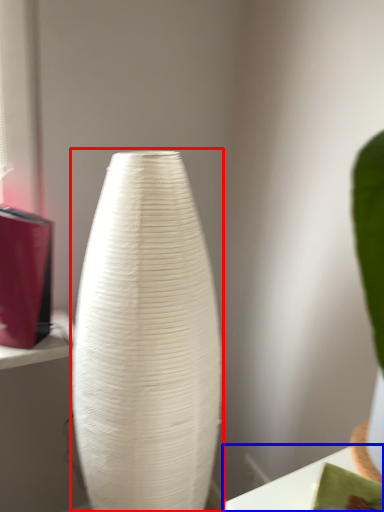
Question: Which point is further to the camera, vase (highlighted by a red box) or table (highlighted by a blue box)?

Choices:
 (A) vase
 (B) table

Answer: (A)